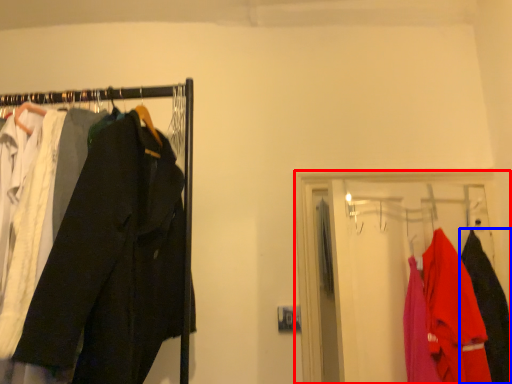
Question: Which of the following is the closest to the observer, closet (highlighted by a red box) or clothing (highlighted by a blue box)?

Choices:
 (A) closet
 (B) clothing

Answer: (A)